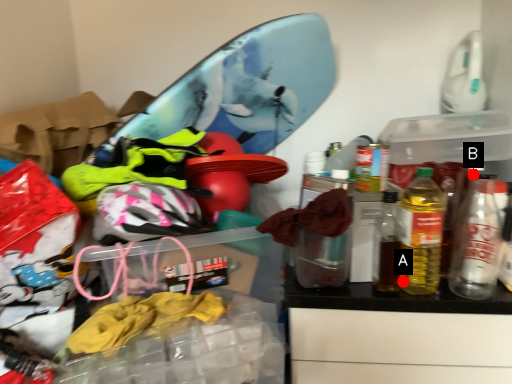
Question: Two points are circled on the image, labeled by A and B beside each circle. Which point is farther to the camera?

Choices:
 (A) A is further
 (B) B is further

Answer: (A)